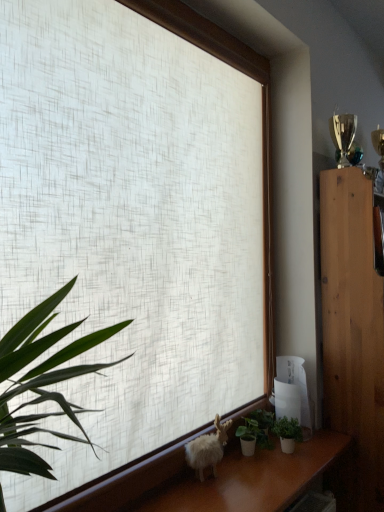
Question: Is white fluffy goat at lower center closer to camera compared to green matte plant at lower right, which is the first houseplant from right to left?

Choices:
 (A) no
 (B) yes

Answer: (B)

Question: Does white fluffy goat at lower center have a greater height compared to green matte plant at lower right, which is counted as the 2th houseplant, starting from the left?

Choices:
 (A) no
 (B) yes

Answer: (B)

Question: Would you say white fluffy goat at lower center contains green matte plant at lower right, which is the first houseplant from right to left?

Choices:
 (A) yes
 (B) no

Answer: (B)

Question: From the image's perspective, is white fluffy goat at lower center over green matte plant at lower right, which is counted as the 2th houseplant, starting from the left?

Choices:
 (A) yes
 (B) no

Answer: (A)

Question: Is white fluffy goat at lower center not near green matte plant at lower right, which is the first houseplant from right to left?

Choices:
 (A) yes
 (B) no

Answer: (B)

Question: Is white fluffy goat at lower center not inside green matte plant at lower right, which is the first houseplant from right to left?

Choices:
 (A) yes
 (B) no

Answer: (A)

Question: Does green matte plant at lower right, which is counted as the 2th houseplant, starting from the left, have a greater width compared to white fluffy goat at lower center?

Choices:
 (A) no
 (B) yes

Answer: (B)

Question: From the image's perspective, does green matte plant at lower right, which is counted as the 2th houseplant, starting from the left, appear lower than white fluffy goat at lower center?

Choices:
 (A) no
 (B) yes

Answer: (B)

Question: Is green matte plant at lower right, which is counted as the 2th houseplant, starting from the left, turned away from white fluffy goat at lower center?

Choices:
 (A) no
 (B) yes

Answer: (A)

Question: Can you confirm if green matte plant at lower right, which is counted as the 2th houseplant, starting from the left, is bigger than white fluffy goat at lower center?

Choices:
 (A) no
 (B) yes

Answer: (A)

Question: Is green matte plant at lower right, which is the first houseplant from right to left, not near white fluffy goat at lower center?

Choices:
 (A) no
 (B) yes

Answer: (A)

Question: Is white fluffy goat at lower center surrounded by green matte plant at lower right, which is counted as the 2th houseplant, starting from the left?

Choices:
 (A) no
 (B) yes

Answer: (A)

Question: From the image's perspective, is white textured fabric at center on white fluffy goat at lower center?

Choices:
 (A) yes
 (B) no

Answer: (A)